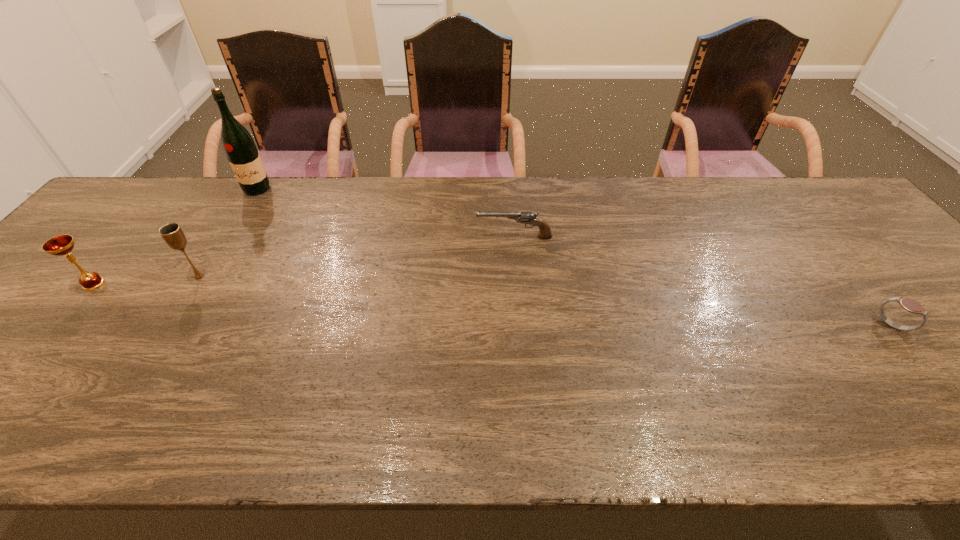
In the image, there is a desktop. Identify the location of vacant area at the left edge. (125, 240).

You are a GUI agent. You are given a task and a screenshot of the screen. Output one action in this format:
    pyautogui.click(x=<x>, y=<y>)
    Task: Click on the vacant space at the right edge of the desktop
    This screenshot has height=540, width=960.
    Given the screenshot: What is the action you would take?
    pyautogui.click(x=900, y=266)

In order to click on free space between the tallest object and the gun in this screenshot , I will do `click(386, 213)`.

Find the location of a particular element. This screenshot has width=960, height=540. unoccupied position between the farthest object and the right chalice is located at coordinates (228, 233).

This screenshot has width=960, height=540. In order to click on empty space that is in between the right chalice and the farthest object in this screenshot , I will do `click(228, 233)`.

Image resolution: width=960 pixels, height=540 pixels. Find the location of `free space between the shorter chalice and the right chalice`. free space between the shorter chalice and the right chalice is located at coordinates (147, 280).

Where is `free space between the farthest object and the right chalice`? free space between the farthest object and the right chalice is located at coordinates (228, 233).

The width and height of the screenshot is (960, 540). I want to click on free space between the right chalice and the third tallest object, so click(x=147, y=280).

Find the location of a particular element. The height and width of the screenshot is (540, 960). free space between the farthest object and the second farthest object is located at coordinates (x=386, y=213).

You are a GUI agent. You are given a task and a screenshot of the screen. Output one action in this format:
    pyautogui.click(x=<x>, y=<y>)
    Task: Click on the free space between the shortest object and the shorter chalice
    The width and height of the screenshot is (960, 540).
    Given the screenshot: What is the action you would take?
    pyautogui.click(x=492, y=305)